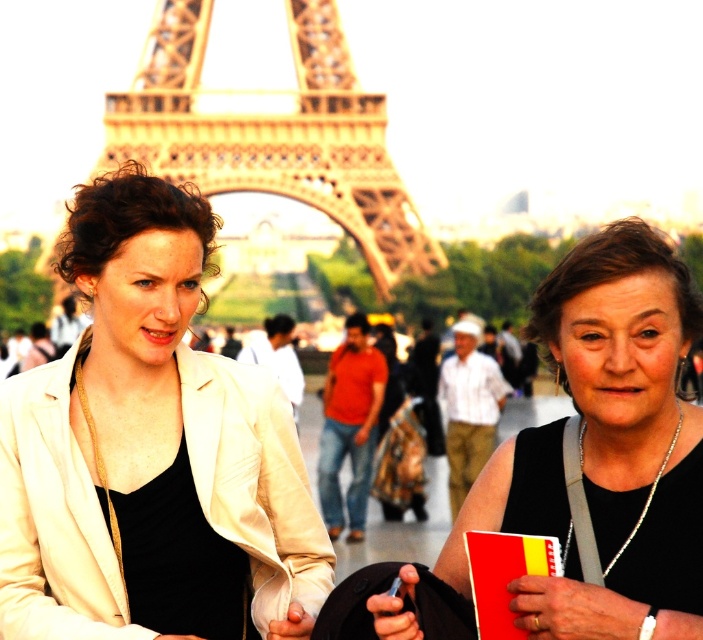
Is matte white jacket at center thinner than golden metallic eiffel tower at center?

Yes.

Consider the image. Is matte white jacket at center below golden metallic eiffel tower at center?

Correct, matte white jacket at center is located below golden metallic eiffel tower at center.

Does point (117, 310) come behind point (408, 243)?

Yes, it is behind point (408, 243).

At what (x,y) coordinates should I click in order to perform the action: click on matte white jacket at center. Please return your answer as a coordinate pair (x, y). This screenshot has height=640, width=703. Looking at the image, I should click on (150, 451).

Is black matte dress at center further to camera compared to golden metallic eiffel tower at center?

No, black matte dress at center is closer to the viewer.

Is black matte dress at center smaller than golden metallic eiffel tower at center?

Yes, black matte dress at center is smaller than golden metallic eiffel tower at center.

Does point (697, 588) lie behind point (188, 179)?

No, (697, 588) is in front of (188, 179).

This screenshot has height=640, width=703. I want to click on black matte dress at center, so click(x=606, y=445).

Is point (75, 241) in front of point (593, 348)?

No.

Can you confirm if matte white jacket at center is thinner than black matte dress at center?

Indeed, matte white jacket at center has a lesser width compared to black matte dress at center.

This screenshot has height=640, width=703. I want to click on matte white jacket at center, so point(150,451).